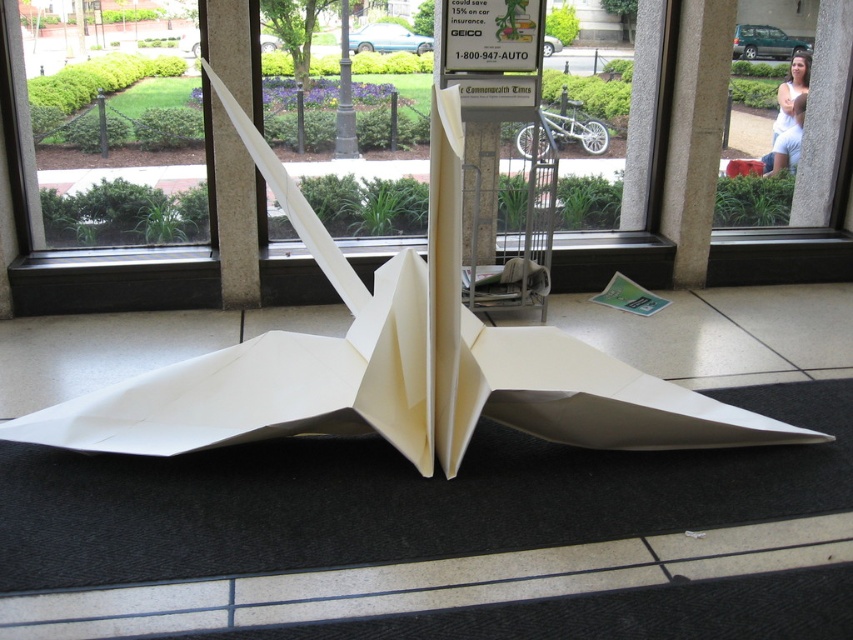
Is white stone pillar at upper right below white paper airplane at center?

No, white stone pillar at upper right is not below white paper airplane at center.

Can you confirm if white stone pillar at upper right is bigger than white paper airplane at center?

No, white stone pillar at upper right is not bigger than white paper airplane at center.

Is point (679, 86) more distant than point (221, 140)?

Yes, it is behind point (221, 140).

This screenshot has height=640, width=853. I want to click on white stone pillar at upper right, so click(x=695, y=134).

Is point (225, 236) closer to viewer compared to point (339, 80)?

Yes, it is in front of point (339, 80).

In the scene shown: Does white paper airplane at center appear on the right side of black metal pole at center?

Indeed, white paper airplane at center is positioned on the right side of black metal pole at center.

I want to click on white paper airplane at center, so (x=234, y=214).

Where is `white paper airplane at center`? This screenshot has height=640, width=853. white paper airplane at center is located at coordinates (234, 214).

Does point (717, 141) lie behind point (343, 128)?

No, it is in front of (343, 128).

Between point (665, 172) and point (345, 16), which one is positioned behind?

Point (345, 16)

Locate an element on the screen. white stone pillar at upper right is located at coordinates (695, 134).